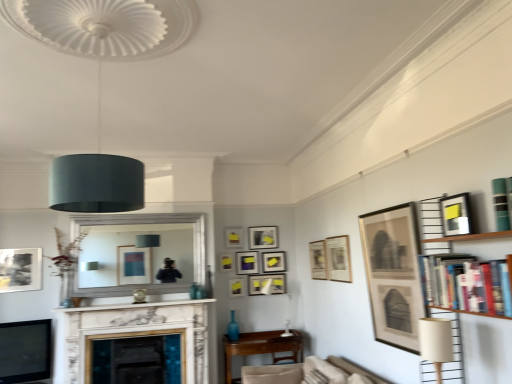
Question: Can you confirm if hardcover books at right is wider than matte white picture frame at upper center, which is the eighth picture frame from front to back?

Choices:
 (A) yes
 (B) no

Answer: (A)

Question: Is hardcover books at right positioned far away from matte white picture frame at upper center, the fifth picture frame viewed from the back?

Choices:
 (A) yes
 (B) no

Answer: (A)

Question: From the image's perspective, is hardcover books at right above matte white picture frame at upper center, the fifth picture frame viewed from the back?

Choices:
 (A) yes
 (B) no

Answer: (A)

Question: Does hardcover books at right lie in front of matte white picture frame at upper center, which is the seventh picture frame from left to right?

Choices:
 (A) no
 (B) yes

Answer: (B)

Question: Is hardcover books at right touching matte white picture frame at upper center, the fifth picture frame viewed from the back?

Choices:
 (A) no
 (B) yes

Answer: (A)

Question: From a real-world perspective, is hardcover books at right positioned over matte white picture frame at upper center, the sixth picture frame from the right, based on gravity?

Choices:
 (A) no
 (B) yes

Answer: (B)

Question: Is teal matte bookshelf at upper right not inside matte beige lampshade at lower right, which is the 2th lamp from left to right?

Choices:
 (A) yes
 (B) no

Answer: (A)

Question: Considering the relative positions of teal matte bookshelf at upper right and matte beige lampshade at lower right, which is counted as the 1th lamp, starting from the bottom, in the image provided, is teal matte bookshelf at upper right to the right of matte beige lampshade at lower right, which is counted as the 1th lamp, starting from the bottom, from the viewer's perspective?

Choices:
 (A) yes
 (B) no

Answer: (A)

Question: From a real-world perspective, is teal matte bookshelf at upper right over matte beige lampshade at lower right, which is counted as the 1th lamp, starting from the bottom?

Choices:
 (A) no
 (B) yes

Answer: (B)

Question: Can you confirm if teal matte bookshelf at upper right is wider than matte beige lampshade at lower right, which is the 2th lamp from left to right?

Choices:
 (A) yes
 (B) no

Answer: (B)

Question: Is teal matte bookshelf at upper right turned away from matte beige lampshade at lower right, which is the 2th lamp from left to right?

Choices:
 (A) no
 (B) yes

Answer: (A)

Question: From the image's perspective, is teal matte bookshelf at upper right beneath matte beige lampshade at lower right, acting as the first lamp starting from the right?

Choices:
 (A) no
 (B) yes

Answer: (A)

Question: From the image's perspective, is matte beige lampshade at lower right, acting as the first lamp starting from the right, on matte yellow picture frame at center, which ranks as the second picture frame in left-to-right order?

Choices:
 (A) no
 (B) yes

Answer: (B)